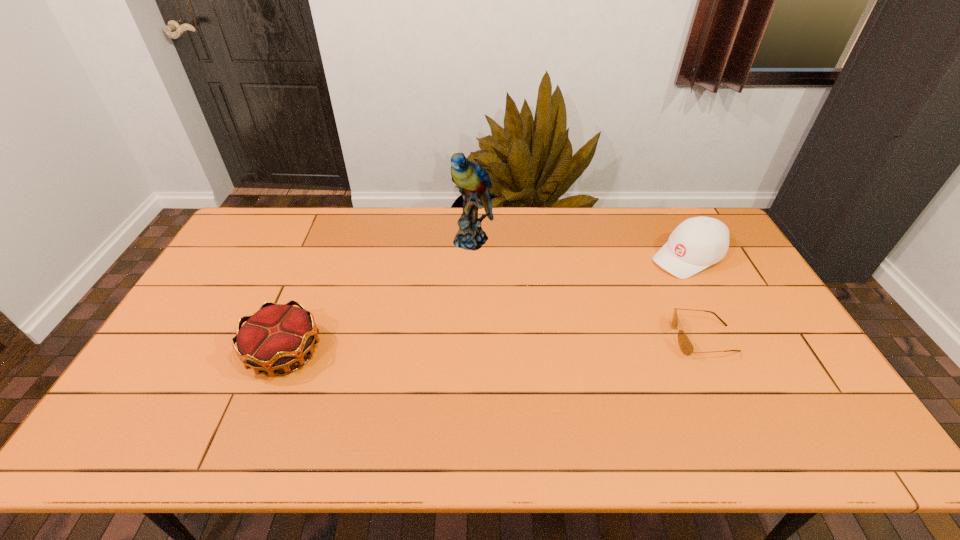
Image resolution: width=960 pixels, height=540 pixels. I want to click on free space between the parrot and the baseball cap, so click(x=581, y=249).

The width and height of the screenshot is (960, 540). I want to click on vacant region between the tallest object and the shortest object, so click(588, 289).

You are a GUI agent. You are given a task and a screenshot of the screen. Output one action in this format:
    pyautogui.click(x=<x>, y=<y>)
    Task: Click on the free space between the shortest object and the leftmost object
    The image size is (960, 540).
    Given the screenshot: What is the action you would take?
    pyautogui.click(x=494, y=346)

You are a GUI agent. You are given a task and a screenshot of the screen. Output one action in this format:
    pyautogui.click(x=<x>, y=<y>)
    Task: Click on the free space that is in between the third object from right to left and the second tallest object
    
    Given the screenshot: What is the action you would take?
    pyautogui.click(x=581, y=249)

I want to click on free space between the parrot and the third shortest object, so click(581, 249).

You are a GUI agent. You are given a task and a screenshot of the screen. Output one action in this format:
    pyautogui.click(x=<x>, y=<y>)
    Task: Click on the empty space that is in between the tallest object and the baseball cap
    This screenshot has height=540, width=960.
    Given the screenshot: What is the action you would take?
    point(581,249)

Identify the location of free area in between the parrot and the shortest object. (588, 289).

Locate an element on the screen. the third closest object to the shortest object is located at coordinates (277, 336).

Identify which object is the third nearest to the third shortest object. Please provide its 2D coordinates. Your answer should be formatted as a tuple, i.e. [(x, y)], where the tuple contains the x and y coordinates of a point satisfying the conditions above.

[(277, 336)]

Locate an element on the screen. The image size is (960, 540). vacant area in the image that satisfies the following two spatial constraints: 1. on the back side of the shortest object; 2. on the front-facing side of the leftmost object is located at coordinates (290, 339).